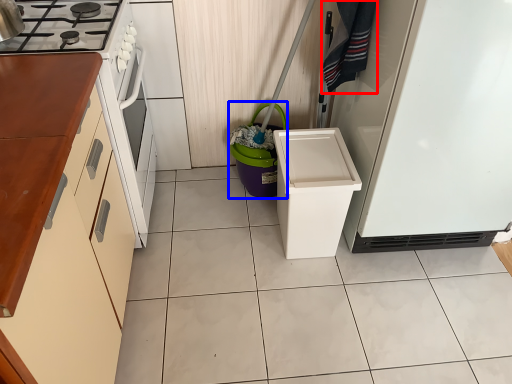
Question: Which object is closer to the camera taking this photo, laundry (highlighted by a red box) or appliance (highlighted by a blue box)?

Choices:
 (A) laundry
 (B) appliance

Answer: (A)